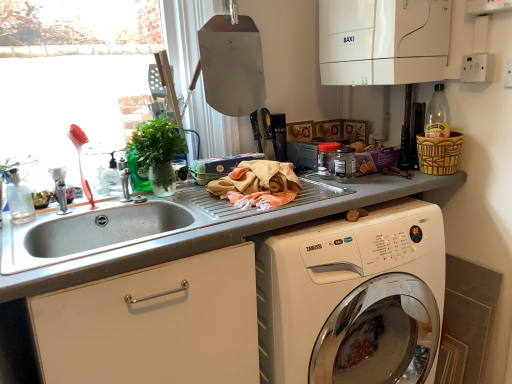
You are a GUI agent. You are given a task and a screenshot of the screen. Output one action in this format:
    pyautogui.click(x=<x>, y=<y>)
    Task: Click on the free space to the left of woven brown basket at upper right
    
    Given the screenshot: What is the action you would take?
    pyautogui.click(x=390, y=178)